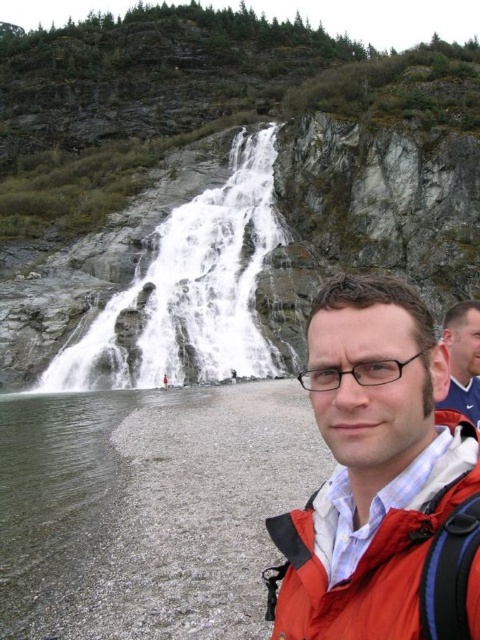
Question: Which point appears farthest from the camera in this image?

Choices:
 (A) (472, 321)
 (B) (178, 252)
 (C) (370, 490)

Answer: (B)

Question: Does matte orange jacket at lower right come in front of white textured water at upper center?

Choices:
 (A) no
 (B) yes

Answer: (B)

Question: Which object is closer to the camera taking this photo?

Choices:
 (A) white textured water at upper center
 (B) matte orange jacket at lower right
 (C) matte black glasses at center

Answer: (B)

Question: Observing the image, what is the correct spatial positioning of matte orange jacket at lower right in reference to matte black glasses at center?

Choices:
 (A) left
 (B) right

Answer: (A)

Question: Which point is closer to the camera taking this photo?

Choices:
 (A) (393, 305)
 (B) (180, 269)

Answer: (A)

Question: Can you confirm if white textured water at upper center is positioned above matte black glasses at center?

Choices:
 (A) no
 (B) yes

Answer: (B)